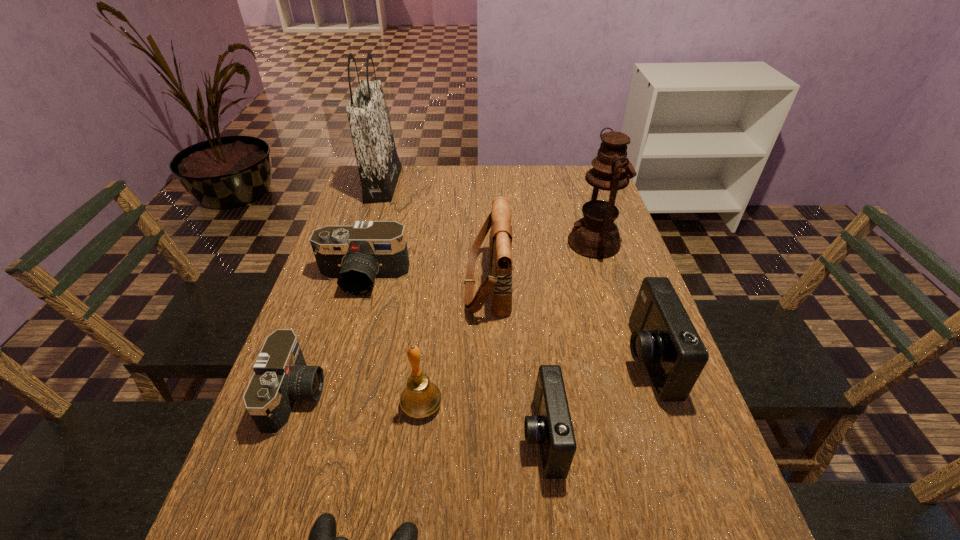
The height and width of the screenshot is (540, 960). I want to click on the farthest object, so click(x=379, y=167).

Locate an element on the screen. the tallest object is located at coordinates (379, 167).

Identify the location of the eighth shortest object. The height and width of the screenshot is (540, 960). (595, 236).

Identify the location of shoulder bag. (499, 283).

This screenshot has width=960, height=540. Identify the location of bell. (421, 398).

Locate an element on the screen. the rightmost camera is located at coordinates pyautogui.click(x=663, y=336).

Locate an element on the screen. The image size is (960, 540). the bigger blue camera is located at coordinates (663, 336).

Find the location of a particular element. The image size is (960, 540). the farthest camera is located at coordinates (356, 256).

What are the coordinates of `the farther black camera` in the screenshot? It's located at (356, 256).

Identify the location of the smaller blue camera. This screenshot has width=960, height=540. (551, 426).